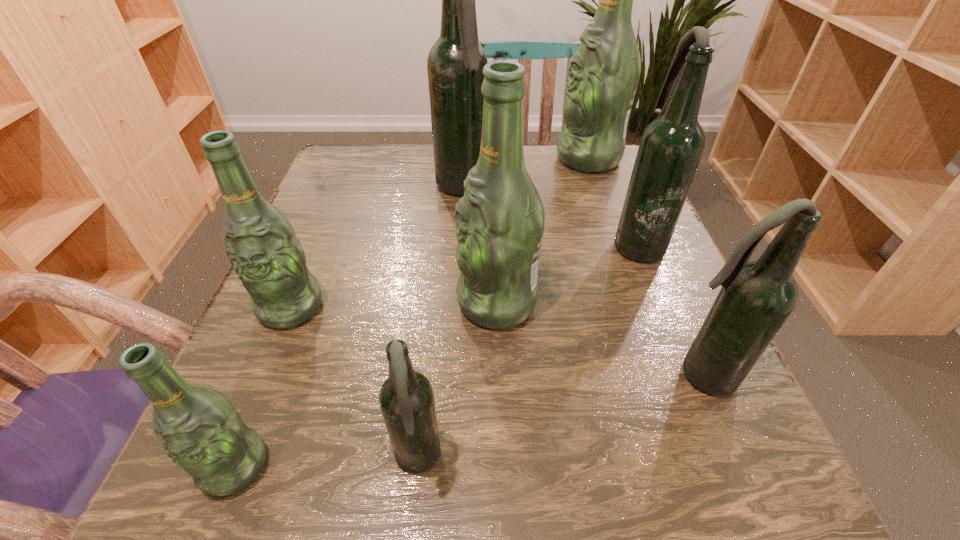
Image resolution: width=960 pixels, height=540 pixels. I want to click on the sixth closest object to the farthest dark beer bottle, so click(x=406, y=398).

Select which object appears as the closest to the nearest green beer bottle. Please provide its 2D coordinates. Your answer should be formatted as a tuple, i.e. [(x, y)], where the tuple contains the x and y coordinates of a point satisfying the conditions above.

[(406, 398)]

Locate an element on the screen. beer bottle that is the fourth nearest to the smallest dark beer bottle is located at coordinates tap(756, 298).

Choose which beer bottle is the fourth nearest neighbor to the rightmost green beer bottle. Please provide its 2D coordinates. Your answer should be formatted as a tuple, i.e. [(x, y)], where the tuple contains the x and y coordinates of a point satisfying the conditions above.

[(756, 298)]

Identify which green beer bottle is the second nearest to the smallest dark beer bottle. Please provide its 2D coordinates. Your answer should be formatted as a tuple, i.e. [(x, y)], where the tuple contains the x and y coordinates of a point satisfying the conditions above.

[(500, 220)]

Find the location of a particular element. the third closest green beer bottle to the biggest dark beer bottle is located at coordinates (261, 245).

I want to click on the closest dark beer bottle to the second biggest dark beer bottle, so click(756, 298).

This screenshot has height=540, width=960. I want to click on dark beer bottle object that ranks as the closest to the farthest green beer bottle, so click(455, 63).

Find the location of `vacant space that satisfies the following two spatial constraints: 1. on the surface of the third nearest object; 2. on the right side of the third biggest green beer bottle`. vacant space that satisfies the following two spatial constraints: 1. on the surface of the third nearest object; 2. on the right side of the third biggest green beer bottle is located at coordinates (263, 375).

At what (x,y) coordinates should I click in order to perform the action: click on free space that satisfies the following two spatial constraints: 1. on the surface of the rightmost green beer bottle; 2. on the surface of the smallest green beer bottle. Please return your answer as a coordinate pair (x, y). This screenshot has height=540, width=960. Looking at the image, I should click on (696, 465).